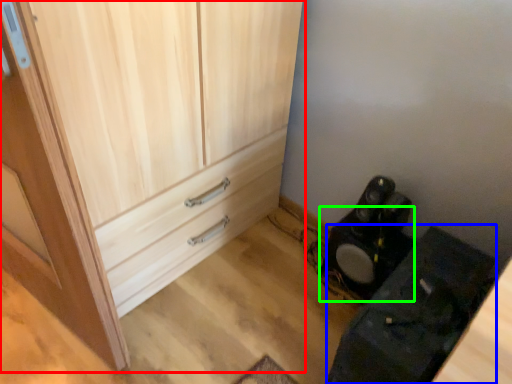
Question: Based on their relative distances, which object is farther from cupboard (highlighted by a red box)? Choose from furniture (highlighted by a blue box) and speaker (highlighted by a green box).

Choices:
 (A) furniture
 (B) speaker

Answer: (A)